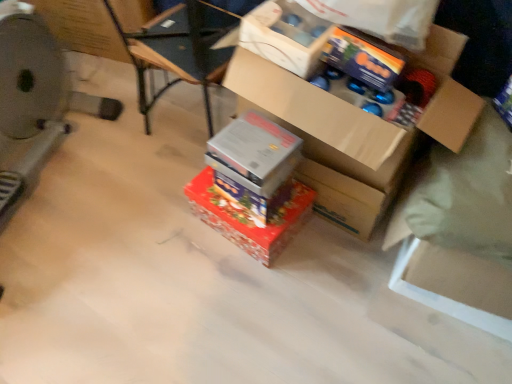
Locate an element on the screen. The height and width of the screenshot is (384, 512). vacant space situated on the left part of shiny metallic box at center, positioned as the 3th box in top-to-bottom order is located at coordinates (168, 228).